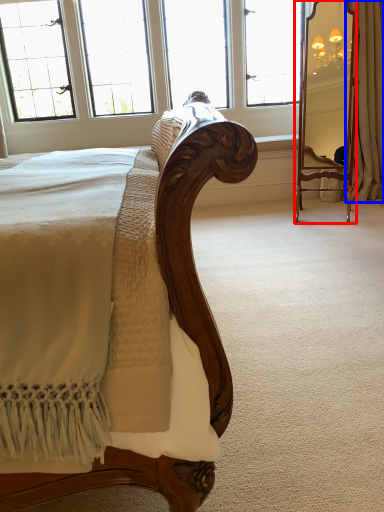
Question: Which point is closer to the camera, mirror (highlighted by a red box) or curtain (highlighted by a blue box)?

Choices:
 (A) mirror
 (B) curtain

Answer: (A)